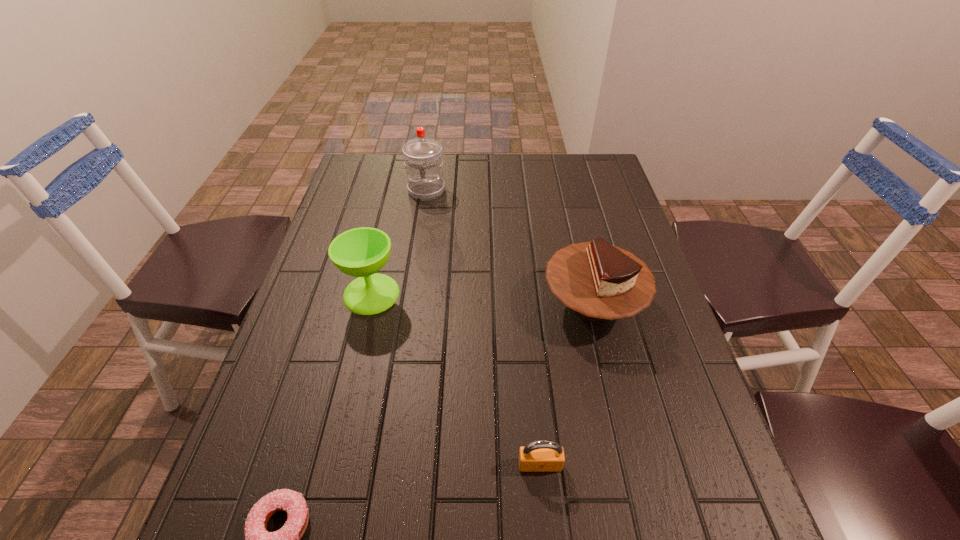
Where is `object that is at the far edge`? object that is at the far edge is located at coordinates (423, 162).

Where is `object at the left edge`? The height and width of the screenshot is (540, 960). object at the left edge is located at coordinates (360, 252).

The width and height of the screenshot is (960, 540). What are the coordinates of `object located in the right edge section of the desktop` in the screenshot? It's located at (599, 281).

Find the location of a particular element. The width and height of the screenshot is (960, 540). free space at the far edge is located at coordinates (451, 190).

At what (x,y) coordinates should I click in order to perform the action: click on vacant area at the left edge of the desktop. Please return your answer as a coordinate pair (x, y). This screenshot has height=540, width=960. Looking at the image, I should click on (262, 461).

Locate an element on the screen. vacant space at the right edge of the desktop is located at coordinates (608, 340).

This screenshot has height=540, width=960. In the image, there is a desktop. In order to click on vacant region at the far left corner in this screenshot , I will do `click(348, 173)`.

This screenshot has height=540, width=960. Identify the location of vacant space that's between the second nearest object and the rightmost object. (566, 385).

Where is `unoccupied area between the rightmost object and the farthest object`? This screenshot has width=960, height=540. unoccupied area between the rightmost object and the farthest object is located at coordinates (510, 247).

This screenshot has width=960, height=540. What are the coordinates of `vacant region between the water bottle and the second object from right to left` in the screenshot? It's located at (483, 327).